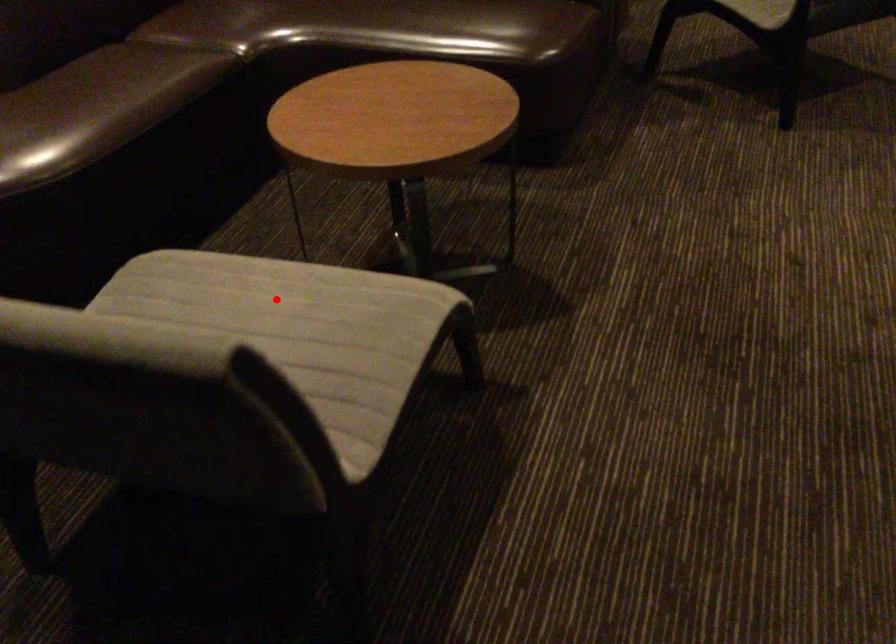
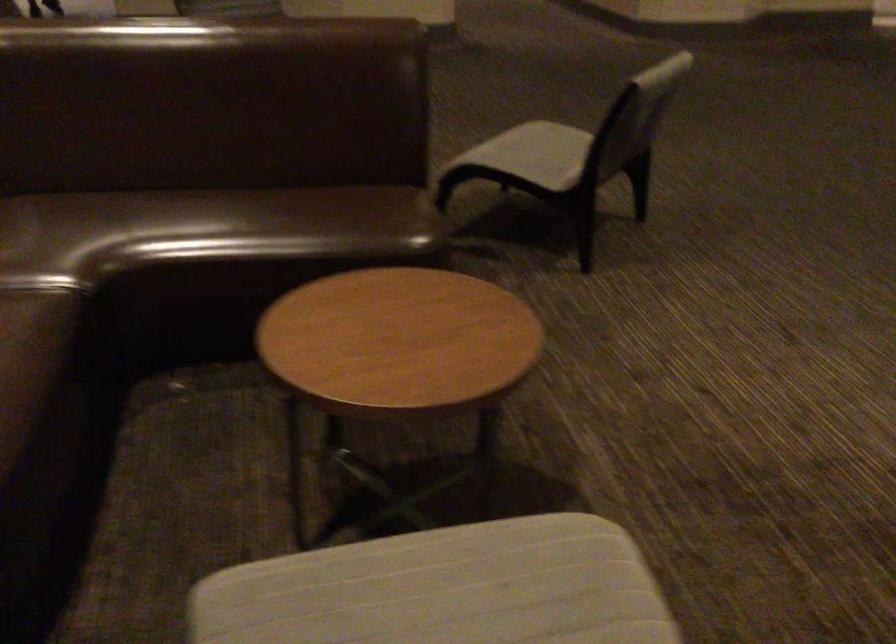
Question: I am providing you with two images of the same scene from different viewpoints. In image1, a red point is highlighted. Considering the same 3D point in image2, which of the following is correct?

Choices:
 (A) It is closer
 (B) It is farther

Answer: (A)